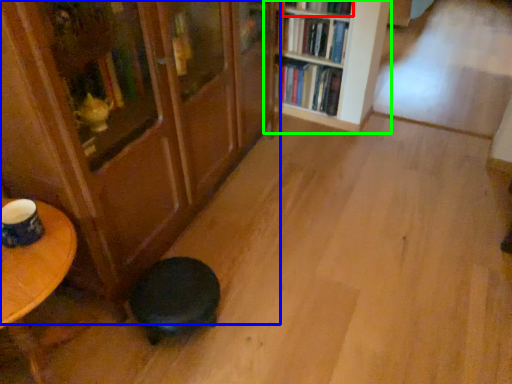
Question: Which is nearer to the book (highlighted by a red box)? bookcase (highlighted by a blue box) or bookcase (highlighted by a green box).

Choices:
 (A) bookcase
 (B) bookcase

Answer: (B)